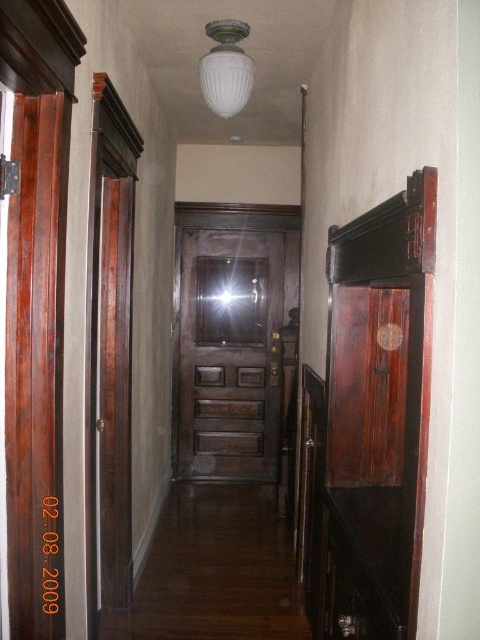
Can you confirm if dark wood door at center is positioned to the right of white frosted glass light fixture at upper center?

Incorrect, dark wood door at center is not on the right side of white frosted glass light fixture at upper center.

Who is shorter, dark wood door at center or white frosted glass light fixture at upper center?

Standing shorter between the two is white frosted glass light fixture at upper center.

Which is in front, point (249, 369) or point (215, 92)?

Point (215, 92) is in front.

The height and width of the screenshot is (640, 480). I want to click on dark wood door at center, so click(229, 348).

Who is taller, mahogany wood door at left or white frosted glass light fixture at upper center?

With more height is mahogany wood door at left.

Is point (110, 515) positioned before point (214, 67)?

No, (110, 515) is behind (214, 67).

Where is `mahogany wood door at left`? The width and height of the screenshot is (480, 640). mahogany wood door at left is located at coordinates (110, 376).

Who is taller, dark wood door at center or mahogany wood door at left?

mahogany wood door at left

How much distance is there between dark wood door at center and mahogany wood door at left?

dark wood door at center is 6.72 feet away from mahogany wood door at left.

Identify the location of dark wood door at center. (229, 348).

The width and height of the screenshot is (480, 640). Identify the location of dark wood door at center. (229, 348).